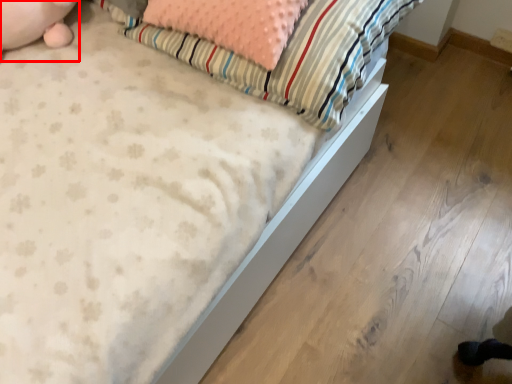
Question: From the image's perspective, where is animal (annotated by the red box) located in relation to pillow in the image?

Choices:
 (A) below
 (B) above

Answer: (B)